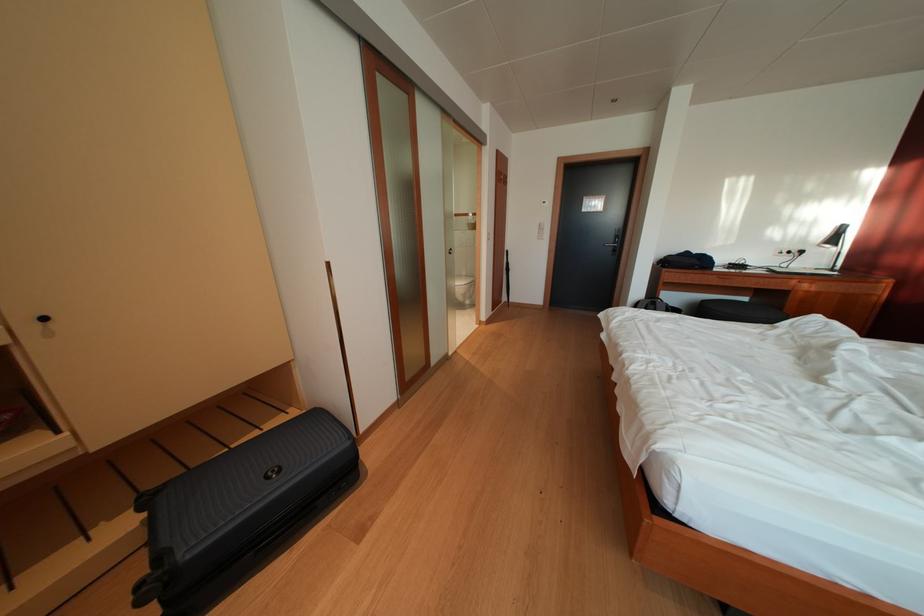
This screenshot has height=616, width=924. Identify the location of white light switch. (541, 230).